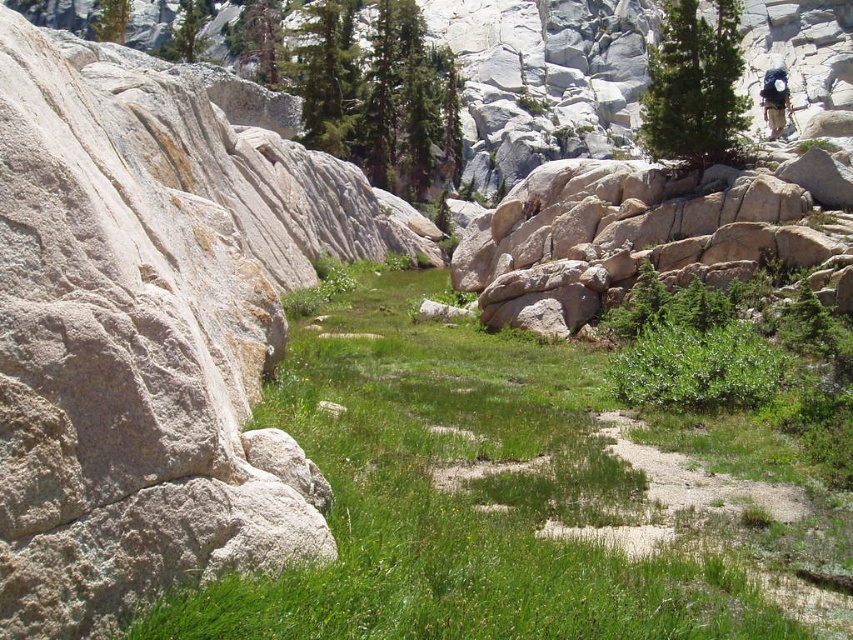
You are a hiker trying to navigate through the rocky terrain. You see a white rock at upper center and a green textured pine tree at upper right. Which object is located to the left of the other?

The white rock at upper center is positioned on the left side of green textured pine tree at upper right.